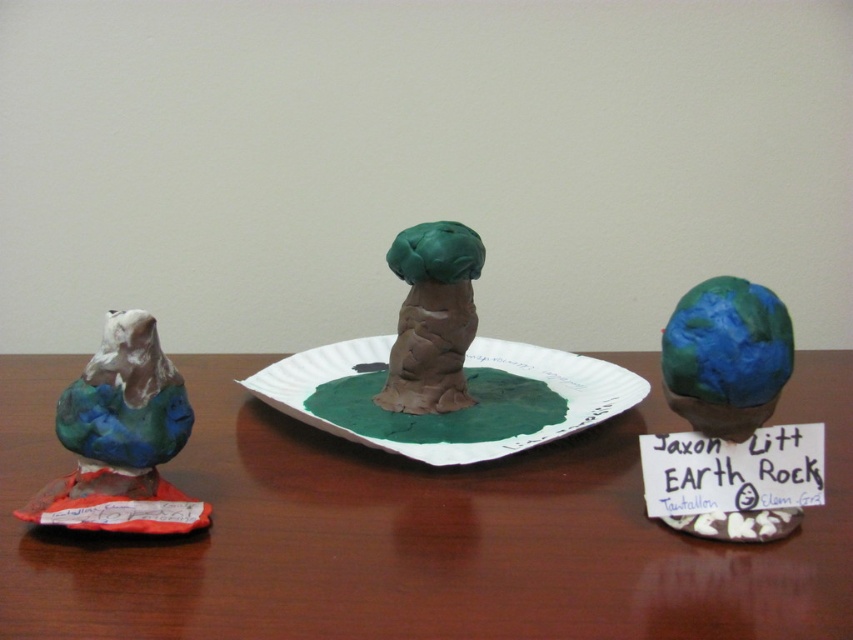
Does wooden table at center appear on the right side of green paper plate at center?

No, wooden table at center is not to the right of green paper plate at center.

How distant is wooden table at center from green paper plate at center?

They are 4.28 inches apart.

Where is `wooden table at center`? The width and height of the screenshot is (853, 640). wooden table at center is located at coordinates (413, 531).

Is green paper plate at center shorter than matte clay bird at left?

Correct, green paper plate at center is not as tall as matte clay bird at left.

Image resolution: width=853 pixels, height=640 pixels. What do you see at coordinates (465, 365) in the screenshot?
I see `green paper plate at center` at bounding box center [465, 365].

Does point (479, 460) come in front of point (126, 337)?

No, it is behind (126, 337).

Locate an element on the screen. The height and width of the screenshot is (640, 853). green paper plate at center is located at coordinates (465, 365).

Is wooden table at center positioned before matte clay bird at left?

That is True.

Between wooden table at center and matte clay bird at left, which one is positioned higher?

Positioned higher is matte clay bird at left.

Does point (543, 448) lie in front of point (136, 323)?

No, it is behind (136, 323).

Where is `wooden table at center`? Image resolution: width=853 pixels, height=640 pixels. wooden table at center is located at coordinates (413, 531).